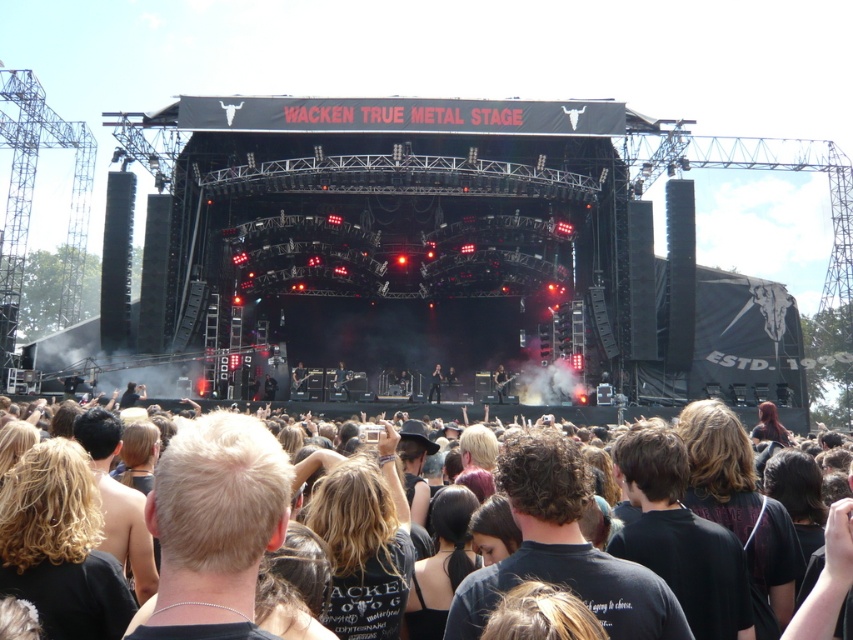
Question: Which is farther from the dark brown leather jacket at center?

Choices:
 (A) shiny black guitar at center
 (B) black fabric crowd at lower center

Answer: (B)

Question: Does black fabric crowd at lower center have a greater width compared to shiny black guitar at center?

Choices:
 (A) no
 (B) yes

Answer: (B)

Question: Among these points, which one is farthest from the camera?

Choices:
 (A) (556, 531)
 (B) (431, 388)
 (C) (498, 372)

Answer: (C)

Question: Does dark brown leather jacket at center have a lesser width compared to shiny black guitar at center?

Choices:
 (A) yes
 (B) no

Answer: (B)

Question: Which point is farther to the camera?

Choices:
 (A) (492, 380)
 (B) (438, 380)

Answer: (A)

Question: Does dark brown leather jacket at center appear over shiny black guitar at center?

Choices:
 (A) no
 (B) yes

Answer: (B)